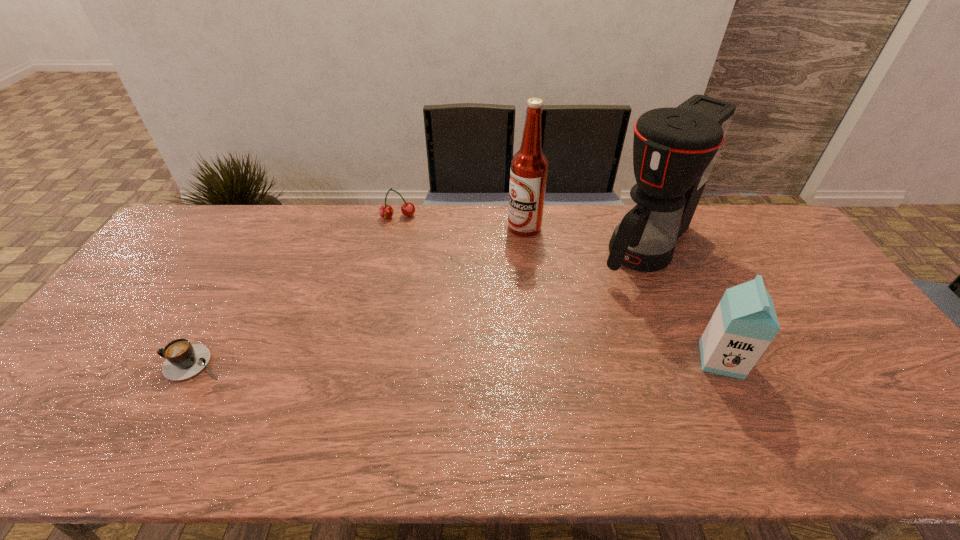
In order to click on cherry that is at the far edge in this screenshot , I will do `click(386, 211)`.

Image resolution: width=960 pixels, height=540 pixels. I want to click on alcohol at the far edge, so click(529, 166).

Locate an element on the screen. The image size is (960, 540). coffee maker present at the far edge is located at coordinates (x=674, y=149).

In the image, there is a desktop. In order to click on blank space at the far edge in this screenshot , I will do `click(269, 233)`.

This screenshot has width=960, height=540. I want to click on blank space at the near edge of the desktop, so click(x=628, y=414).

In the image, there is a desktop. Where is `vacant space at the far left corner`? vacant space at the far left corner is located at coordinates (172, 233).

In the image, there is a desktop. Where is `vacant space at the far right corner`? The height and width of the screenshot is (540, 960). vacant space at the far right corner is located at coordinates (761, 237).

You are a GUI agent. You are given a task and a screenshot of the screen. Output one action in this format:
    pyautogui.click(x=<x>, y=<y>)
    Task: Click on the vacant area between the alcohol and the second object from left to right
    
    Given the screenshot: What is the action you would take?
    pyautogui.click(x=461, y=222)

I want to click on free spot between the leftmost object and the coffee maker, so click(x=421, y=305).

Find the location of `vacant area that lies between the milk carton and the cappuccino`. vacant area that lies between the milk carton and the cappuccino is located at coordinates (459, 361).